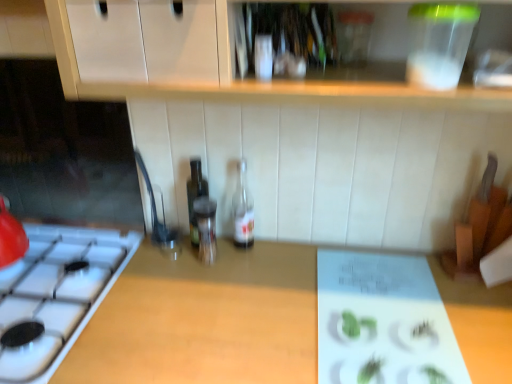
Locate an element on the screen. This screenshot has height=384, width=512. vacant area that is in front of transparent glass bottle at center, which is the 2th bottle from left to right is located at coordinates (199, 301).